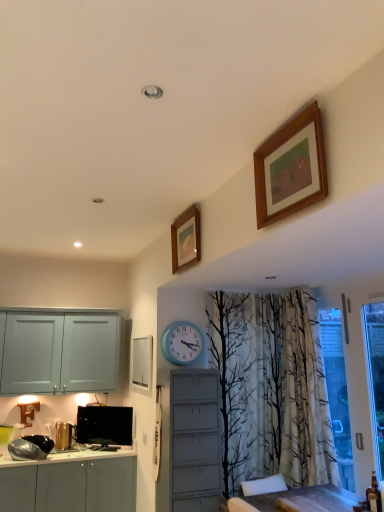
Image resolution: width=384 pixels, height=512 pixels. I want to click on vacant space situated above black glossy television at lower left (from a real-world perspective), so click(104, 407).